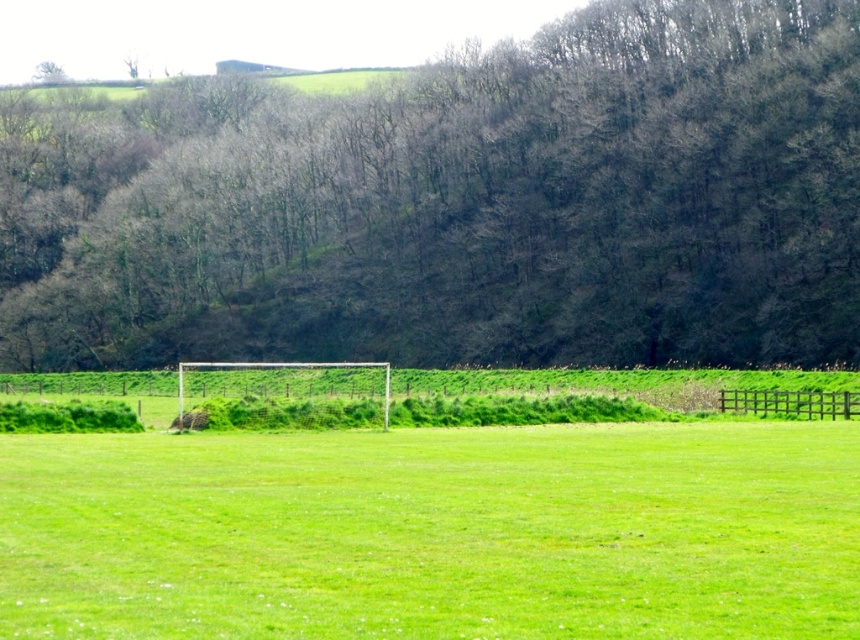
Which is above, brown leafless trees at center or green leafy tree at upper left?

green leafy tree at upper left is higher up.

Is brown leafless trees at center taller than green leafy tree at upper left?

Indeed, brown leafless trees at center has a greater height compared to green leafy tree at upper left.

Between point (100, 323) and point (43, 61), which one is positioned in front?

Point (100, 323) is more forward.

Image resolution: width=860 pixels, height=640 pixels. What are the coordinates of `brown leafless trees at center` in the screenshot? It's located at (465, 205).

Is brown leafless trees at center to the right of furry brown dog at center from the viewer's perspective?

In fact, brown leafless trees at center is to the left of furry brown dog at center.

Locate an element on the screen. The image size is (860, 640). brown leafless trees at center is located at coordinates (465, 205).

Image resolution: width=860 pixels, height=640 pixels. In order to click on brown leafless trees at center in this screenshot , I will do `click(465, 205)`.

Locate an element on the screen. This screenshot has height=640, width=860. brown leafless trees at center is located at coordinates (465, 205).

How far apart are furry brown dog at center and green leafy tree at upper left?

furry brown dog at center and green leafy tree at upper left are 278.82 meters apart.

Which of these two, furry brown dog at center or green leafy tree at upper left, stands taller?

green leafy tree at upper left is taller.

Find the location of a particular element. The image size is (860, 640). furry brown dog at center is located at coordinates (194, 419).

Image resolution: width=860 pixels, height=640 pixels. I want to click on furry brown dog at center, so click(194, 419).